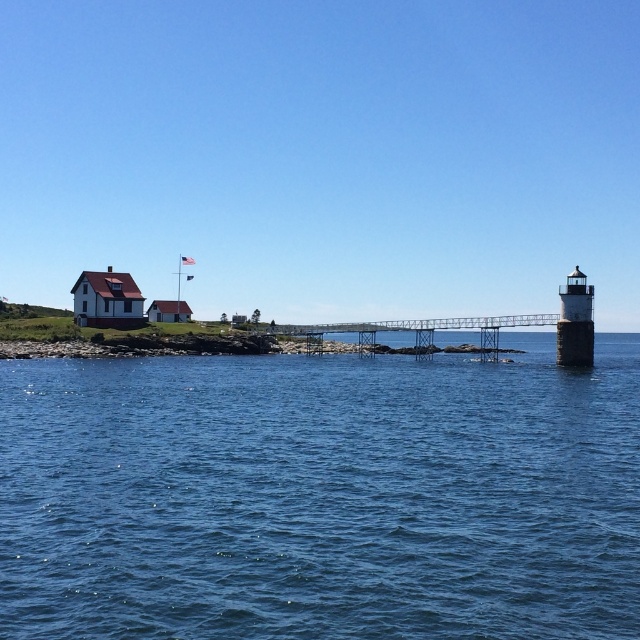
Question: Can you confirm if blue water at center is wider than white fabric flag at upper center?

Choices:
 (A) no
 (B) yes

Answer: (B)

Question: Does blue water at center appear on the right side of white fabric flag at upper center?

Choices:
 (A) yes
 (B) no

Answer: (A)

Question: Which object appears farthest from the camera in this image?

Choices:
 (A) blue water at center
 (B) white fabric flag at upper center

Answer: (B)

Question: Which object is closer to the camera taking this photo?

Choices:
 (A) white fabric flag at upper center
 (B) blue water at center

Answer: (B)

Question: Which object appears farthest from the camera in this image?

Choices:
 (A) white fabric flag at upper center
 (B) blue water at center

Answer: (A)

Question: Does blue water at center appear over white fabric flag at upper center?

Choices:
 (A) yes
 (B) no

Answer: (B)